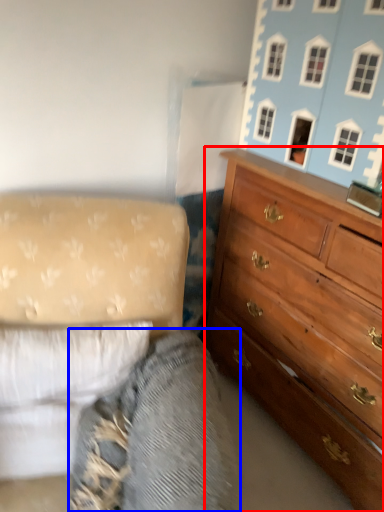
Question: Which point is further to the camera, chest of drawers (highlighted by a red box) or gray (highlighted by a blue box)?

Choices:
 (A) chest of drawers
 (B) gray

Answer: (A)